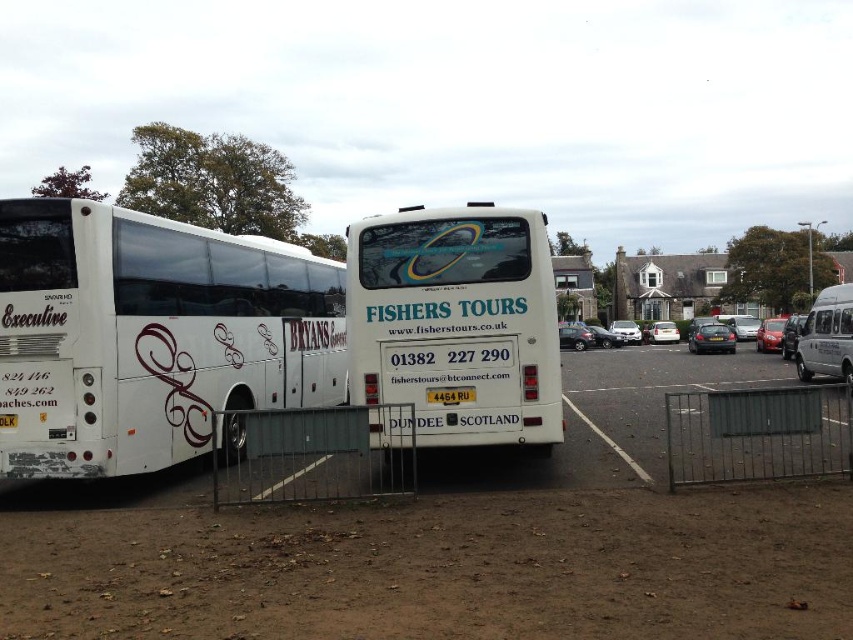
Is yellow matte license plate at center closer to camera compared to metallic silver car at center?

Yes, yellow matte license plate at center is in front of metallic silver car at center.

Based on the photo, is yellow matte license plate at center shorter than metallic silver car at center?

Correct, yellow matte license plate at center is not as tall as metallic silver car at center.

Which is in front, point (460, 396) or point (670, 337)?

Point (460, 396)

The height and width of the screenshot is (640, 853). In order to click on yellow matte license plate at center in this screenshot , I will do `click(450, 394)`.

Is point (415, 246) closer to camera compared to point (784, 332)?

Yes, it is.

Which is more to the right, white matte bus at center or shiny black sedan at right?

shiny black sedan at right is more to the right.

Who is more distant from viewer, (515, 209) or (791, 326)?

The point (791, 326) is more distant.

The width and height of the screenshot is (853, 640). What are the coordinates of `white matte bus at center` in the screenshot? It's located at (457, 321).

Is point (715, 328) behind point (450, 396)?

Yes, it is behind point (450, 396).

Is shiny black sedan at center positioned before yellow matte license plate at center?

No, shiny black sedan at center is behind yellow matte license plate at center.

Where is `shiny black sedan at center`? shiny black sedan at center is located at coordinates (711, 339).